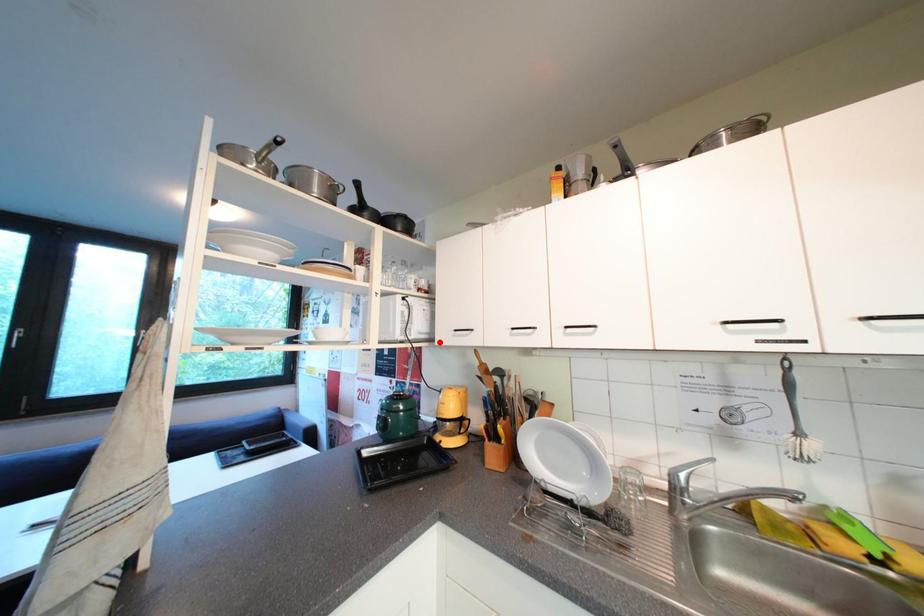
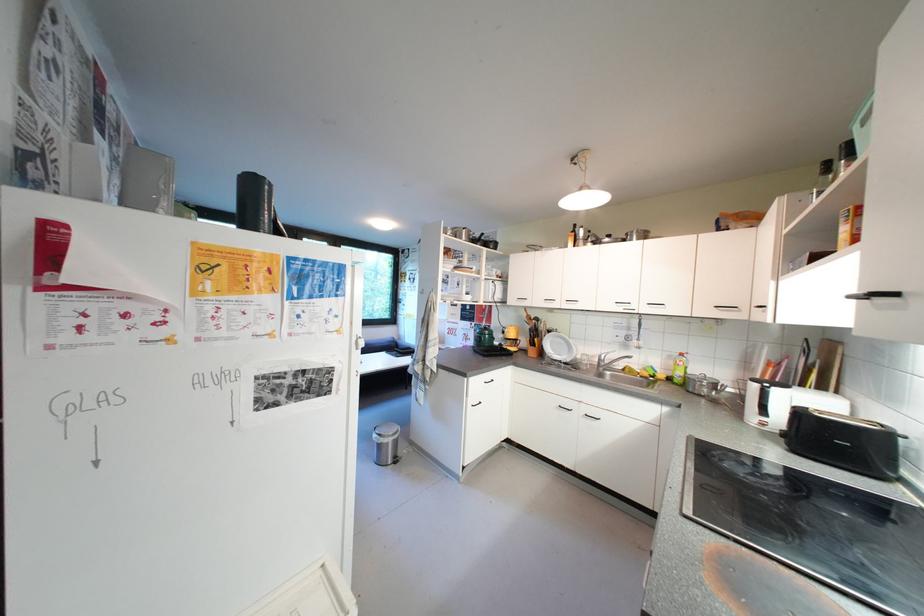
In the second image, find the point that corresponds to the highlighted location in the first image.

(512, 304)